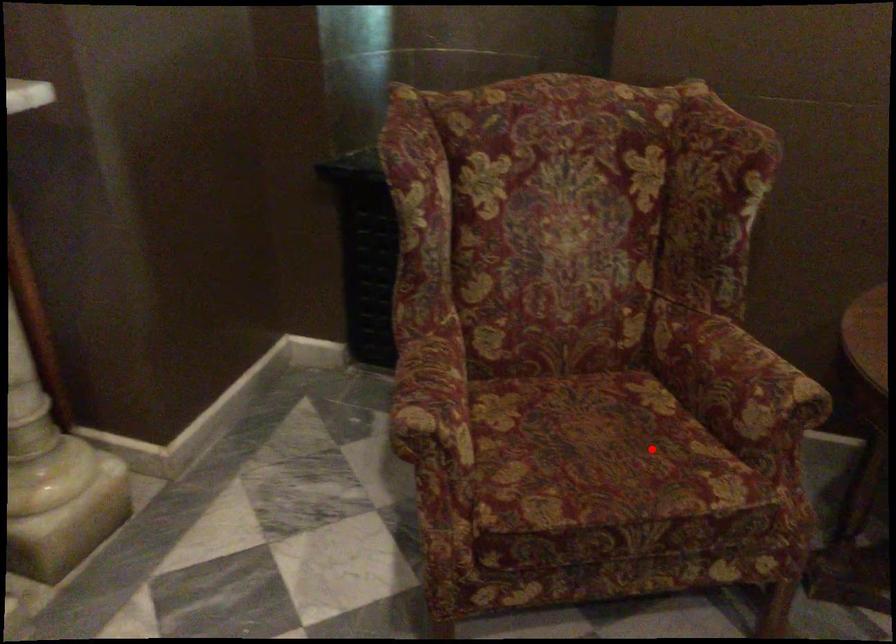
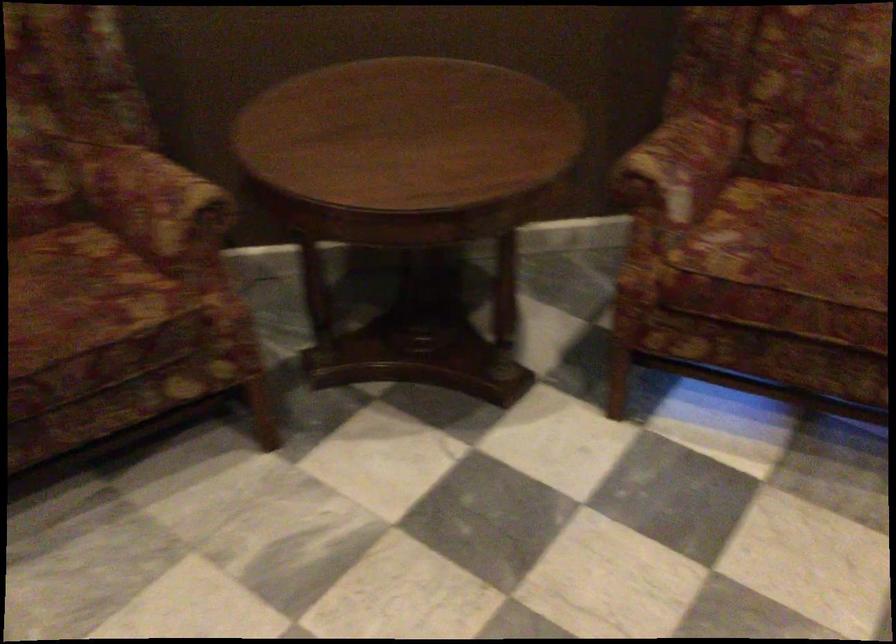
The point at the highlighted location is marked in the first image. Where is the corresponding point in the second image?

(80, 292)